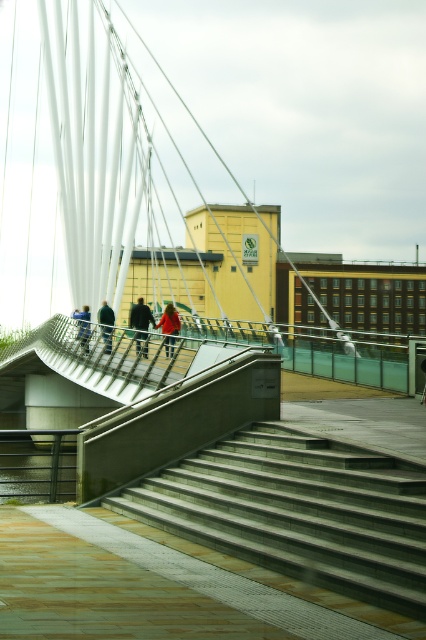
Measure the distance between dark green jacket at center and red fabric coat at center.

dark green jacket at center and red fabric coat at center are 33.54 inches apart from each other.

Between dark green jacket at center and red fabric coat at center, which one has more height?

dark green jacket at center

Image resolution: width=426 pixels, height=640 pixels. I want to click on dark green jacket at center, so click(x=141, y=316).

Is red fabric coat at center to the right of dark gray jacket at center from the viewer's perspective?

Yes, red fabric coat at center is to the right of dark gray jacket at center.

Can you confirm if red fabric coat at center is positioned above dark gray jacket at center?

No, red fabric coat at center is not above dark gray jacket at center.

Is point (164, 326) farther from viewer compared to point (108, 326)?

No, (164, 326) is closer to viewer.

In order to click on red fabric coat at center in this screenshot , I will do `click(169, 326)`.

Which is more to the right, dark gray jacket at center or blue fabric jacket at center?

dark gray jacket at center

Is dark gray jacket at center shorter than blue fabric jacket at center?

In fact, dark gray jacket at center may be taller than blue fabric jacket at center.

I want to click on dark gray jacket at center, so click(106, 324).